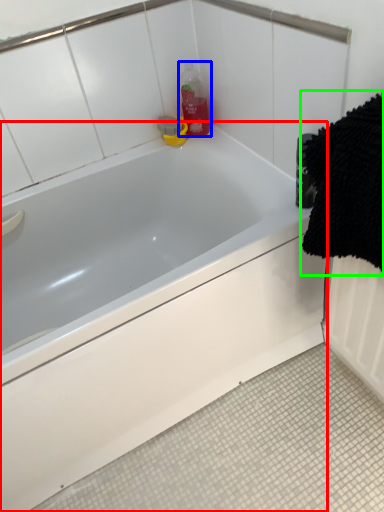
Question: Based on their relative distances, which object is nearer to bathtub (highlighted by a red box)? Choose from cleaning product (highlighted by a blue box) and bath towel (highlighted by a green box).

Choices:
 (A) cleaning product
 (B) bath towel

Answer: (B)